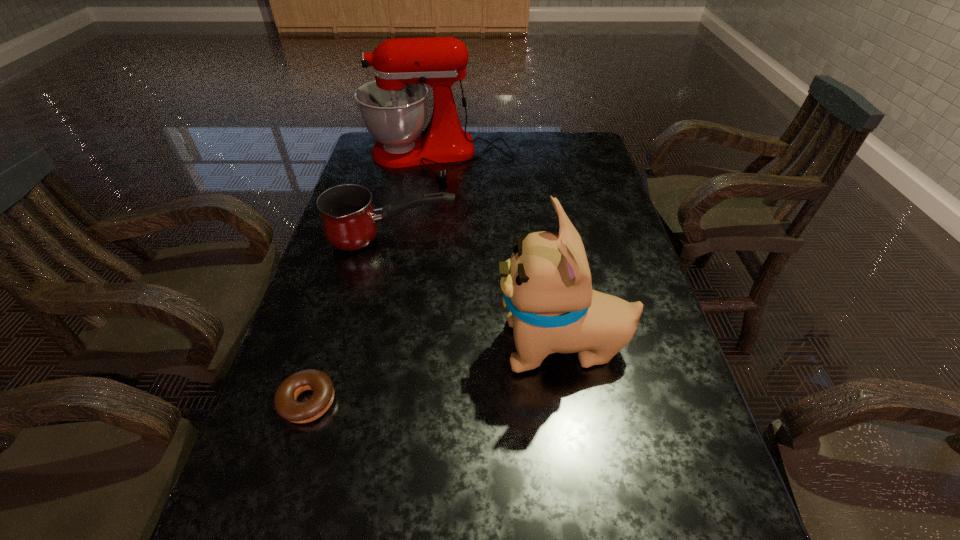
Locate an element on the screen. The width and height of the screenshot is (960, 540). free space between the shortest object and the puppy is located at coordinates (435, 374).

Find the location of `vacant area that lies between the farthest object and the puppy`. vacant area that lies between the farthest object and the puppy is located at coordinates (499, 252).

Locate an element on the screen. This screenshot has width=960, height=540. empty location between the puppy and the farthest object is located at coordinates (499, 252).

Find the location of a particular element. unoccupied position between the shortest object and the farthest object is located at coordinates (372, 280).

Where is `blank region between the mixer and the doughnut`? blank region between the mixer and the doughnut is located at coordinates (372, 280).

You are a GUI agent. You are given a task and a screenshot of the screen. Output one action in this format:
    pyautogui.click(x=<x>, y=<y>)
    Task: Click on the empty location between the puppy and the mixer
    
    Given the screenshot: What is the action you would take?
    pyautogui.click(x=499, y=252)

At what (x,y) coordinates should I click in order to perform the action: click on vacant area between the puppy and the mixer. Please return your answer as a coordinate pair (x, y). Looking at the image, I should click on (499, 252).

Identify the location of vacant space that's between the second farthest object and the shortest object. (350, 321).

Where is `object that is the third closest to the puppy`? The width and height of the screenshot is (960, 540). object that is the third closest to the puppy is located at coordinates [x=393, y=108].

Where is `the second closest object to the third tallest object`? This screenshot has width=960, height=540. the second closest object to the third tallest object is located at coordinates (547, 287).